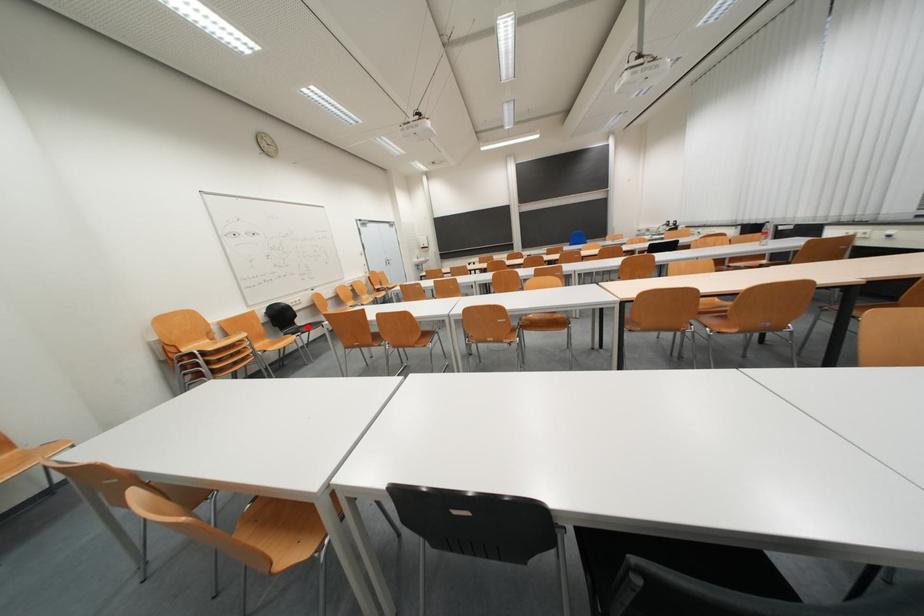
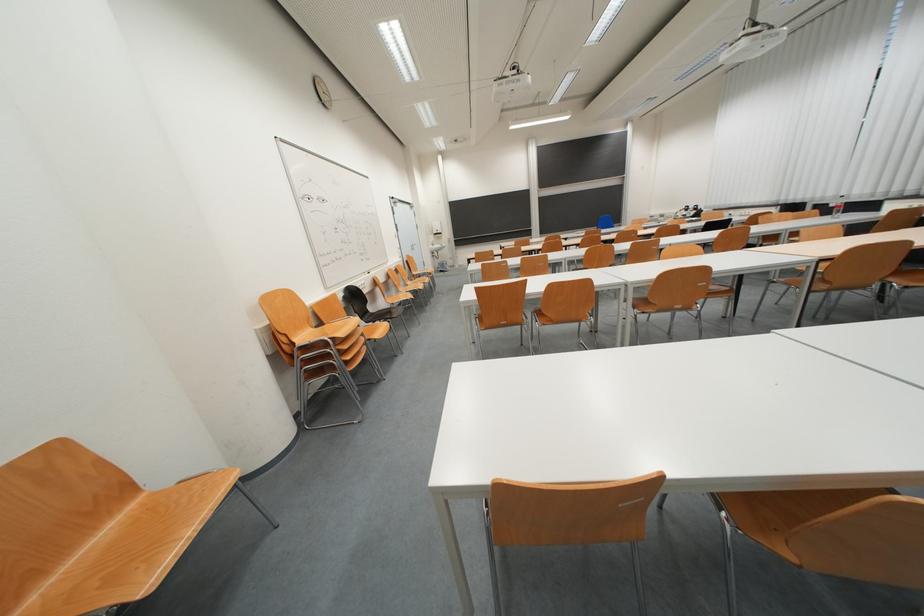
Question: I am providing you with two images of the same scene from different viewpoints. A red point is shown in image1. For the corresponding object point in image2, is it positioned nearer or farther from the camera?

Choices:
 (A) Nearer
 (B) Farther

Answer: (A)